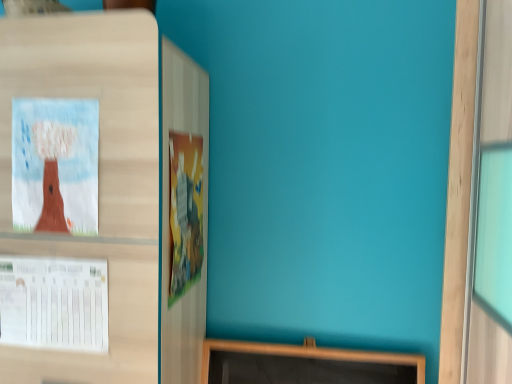
Identify the location of white paper at left, the 2th poster from the right. The width and height of the screenshot is (512, 384). (54, 303).

Describe the element at coordinates (54, 303) in the screenshot. I see `white paper at left, the 2th poster from the right` at that location.

Describe the element at coordinates (185, 212) in the screenshot. Image resolution: width=512 pixels, height=384 pixels. I see `cartoonish paper poster at center, which ranks as the 2th poster in left-to-right order` at that location.

At what (x,y) coordinates should I click in order to perform the action: click on cartoonish paper poster at center, which is the 1th poster in right-to-left order. Please return your answer as a coordinate pair (x, y). Looking at the image, I should click on (185, 212).

What is the approximate width of cartoonish paper poster at center, which is the 1th poster in right-to-left order?

5.50 centimeters.

At what (x,y) coordinates should I click in order to perform the action: click on white paper at left, the 2th poster from the right. Please return your answer as a coordinate pair (x, y). This screenshot has width=512, height=384. Looking at the image, I should click on (54, 303).

Based on their positions, is cartoonish paper poster at center, which ranks as the 2th poster in left-to-right order, located to the left or right of white paper at left, the first poster from the left?

In the image, cartoonish paper poster at center, which ranks as the 2th poster in left-to-right order, appears on the right side of white paper at left, the first poster from the left.

In the image, is cartoonish paper poster at center, which is the 1th poster in right-to-left order, positioned in front of or behind white paper at left, the 2th poster from the right?

cartoonish paper poster at center, which is the 1th poster in right-to-left order, is positioned farther from the viewer than white paper at left, the 2th poster from the right.

Considering the positions of points (180, 294) and (58, 281), is point (180, 294) farther from camera compared to point (58, 281)?

Yes, it is behind point (58, 281).

From the image's perspective, which is below, cartoonish paper poster at center, which is the 1th poster in right-to-left order, or white paper at left, the first poster from the left?

white paper at left, the first poster from the left, from the image's perspective.

From a real-world perspective, is cartoonish paper poster at center, which ranks as the 2th poster in left-to-right order, physically above white paper at left, the 2th poster from the right?

Yes, from a real-world perspective, cartoonish paper poster at center, which ranks as the 2th poster in left-to-right order, is above white paper at left, the 2th poster from the right.

Looking at their sizes, would you say cartoonish paper poster at center, which is the 1th poster in right-to-left order, is wider or thinner than white paper at left, the 2th poster from the right?

Clearly, cartoonish paper poster at center, which is the 1th poster in right-to-left order, has more width compared to white paper at left, the 2th poster from the right.

Between cartoonish paper poster at center, which is the 1th poster in right-to-left order, and white paper at left, the first poster from the left, which one has less height?

white paper at left, the first poster from the left, is shorter.

Can you confirm if cartoonish paper poster at center, which ranks as the 2th poster in left-to-right order, is smaller than white paper at left, the 2th poster from the right?

No, cartoonish paper poster at center, which ranks as the 2th poster in left-to-right order, is not smaller than white paper at left, the 2th poster from the right.

Choose the correct answer: Is cartoonish paper poster at center, which is the 1th poster in right-to-left order, inside white paper at left, the first poster from the left, or outside it?

cartoonish paper poster at center, which is the 1th poster in right-to-left order, lies outside white paper at left, the first poster from the left.

Based on the photo, are cartoonish paper poster at center, which is the 1th poster in right-to-left order, and white paper at left, the 2th poster from the right, beside each other?

No, cartoonish paper poster at center, which is the 1th poster in right-to-left order, is not in contact with white paper at left, the 2th poster from the right.

Is cartoonish paper poster at center, which ranks as the 2th poster in left-to-right order, turned away from white paper at left, the 2th poster from the right?

That's right, cartoonish paper poster at center, which ranks as the 2th poster in left-to-right order, is facing away from white paper at left, the 2th poster from the right.

What's the angular difference between cartoonish paper poster at center, which is the 1th poster in right-to-left order, and white paper at left, the 2th poster from the right,'s facing directions?

cartoonish paper poster at center, which is the 1th poster in right-to-left order, and white paper at left, the 2th poster from the right, are facing 90 degrees away from each other.

Measure the distance between cartoonish paper poster at center, which ranks as the 2th poster in left-to-right order, and white paper at left, the 2th poster from the right.

cartoonish paper poster at center, which ranks as the 2th poster in left-to-right order, and white paper at left, the 2th poster from the right, are 10.51 inches apart from each other.

You are a GUI agent. You are given a task and a screenshot of the screen. Output one action in this format:
    pyautogui.click(x=<x>, y=<y>)
    Task: Click on the poster located below the cartoonish paper poster at center, which ranks as the 2th poster in left-to-right order (from the image's perspective)
    This screenshot has height=384, width=512.
    Given the screenshot: What is the action you would take?
    pyautogui.click(x=54, y=303)

Is white paper at left, the first poster from the left, to the left of cartoonish paper poster at center, which is the 1th poster in right-to-left order, from the viewer's perspective?

Indeed, white paper at left, the first poster from the left, is positioned on the left side of cartoonish paper poster at center, which is the 1th poster in right-to-left order.

Which is in front, white paper at left, the first poster from the left, or cartoonish paper poster at center, which ranks as the 2th poster in left-to-right order?

white paper at left, the first poster from the left.

Is point (101, 277) farther from viewer compared to point (195, 222)?

No, it is in front of (195, 222).

From the image's perspective, which is above, white paper at left, the 2th poster from the right, or cartoonish paper poster at center, which is the 1th poster in right-to-left order?

cartoonish paper poster at center, which is the 1th poster in right-to-left order, appears higher in the image.

From the picture: From a real-world perspective, is white paper at left, the first poster from the left, above or below cartoonish paper poster at center, which is the 1th poster in right-to-left order?

In terms of real-world spatial position, white paper at left, the first poster from the left, is below cartoonish paper poster at center, which is the 1th poster in right-to-left order.

Is white paper at left, the first poster from the left, wider than cartoonish paper poster at center, which is the 1th poster in right-to-left order?

In fact, white paper at left, the first poster from the left, might be narrower than cartoonish paper poster at center, which is the 1th poster in right-to-left order.

Can you confirm if white paper at left, the first poster from the left, is shorter than cartoonish paper poster at center, which ranks as the 2th poster in left-to-right order?

Correct, white paper at left, the first poster from the left, is not as tall as cartoonish paper poster at center, which ranks as the 2th poster in left-to-right order.

Between white paper at left, the 2th poster from the right, and cartoonish paper poster at center, which ranks as the 2th poster in left-to-right order, which one has larger size?

cartoonish paper poster at center, which ranks as the 2th poster in left-to-right order.

Which is correct: white paper at left, the 2th poster from the right, is inside cartoonish paper poster at center, which ranks as the 2th poster in left-to-right order, or outside of it?

white paper at left, the 2th poster from the right, lies outside cartoonish paper poster at center, which ranks as the 2th poster in left-to-right order.

Can you see white paper at left, the 2th poster from the right, touching cartoonish paper poster at center, which is the 1th poster in right-to-left order?

There is a gap between white paper at left, the 2th poster from the right, and cartoonish paper poster at center, which is the 1th poster in right-to-left order.

Is white paper at left, the first poster from the left, facing away from cartoonish paper poster at center, which is the 1th poster in right-to-left order?

No, white paper at left, the first poster from the left, is not facing away from cartoonish paper poster at center, which is the 1th poster in right-to-left order.

Find the location of a particular element. The image size is (512, 384). poster in front of the cartoonish paper poster at center, which is the 1th poster in right-to-left order is located at coordinates click(x=54, y=303).

The image size is (512, 384). Find the location of `poster in front of the cartoonish paper poster at center, which ranks as the 2th poster in left-to-right order`. poster in front of the cartoonish paper poster at center, which ranks as the 2th poster in left-to-right order is located at coordinates (54, 303).

Where is `poster beneath the cartoonish paper poster at center, which ranks as the 2th poster in left-to-right order (from a real-world perspective)`? Image resolution: width=512 pixels, height=384 pixels. poster beneath the cartoonish paper poster at center, which ranks as the 2th poster in left-to-right order (from a real-world perspective) is located at coordinates (54, 303).